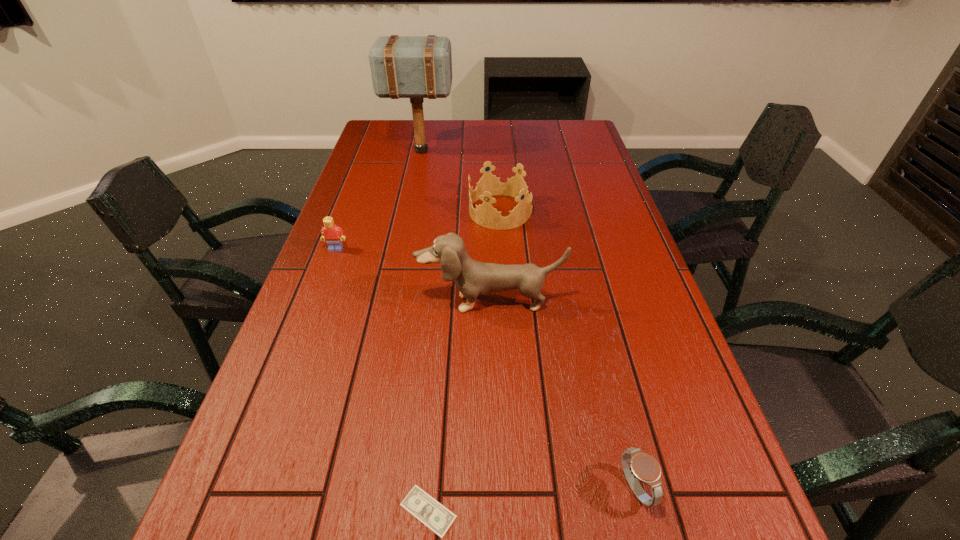
The width and height of the screenshot is (960, 540). Find the location of `Lego that is positioned at the left edge`. Lego that is positioned at the left edge is located at coordinates (333, 235).

At what (x,y) coordinates should I click in order to perform the action: click on object that is at the right edge. Please return your answer as a coordinate pair (x, y). Looking at the image, I should click on (637, 465).

In order to click on object that is at the far left corner in this screenshot , I will do `click(416, 67)`.

You are a GUI agent. You are given a task and a screenshot of the screen. Output one action in this format:
    pyautogui.click(x=<x>, y=<y>)
    Task: Click on the free space at the far edge
    The width and height of the screenshot is (960, 540).
    Given the screenshot: What is the action you would take?
    pyautogui.click(x=538, y=132)

In the image, there is a desktop. What are the coordinates of `vacant region at the left edge` in the screenshot? It's located at (258, 470).

The width and height of the screenshot is (960, 540). I want to click on free region at the right edge, so click(645, 275).

Find the location of a particular element. vacant space at the far left corner of the desktop is located at coordinates (411, 124).

Where is `vacant space at the far right corner of the desktop`? This screenshot has width=960, height=540. vacant space at the far right corner of the desktop is located at coordinates click(x=575, y=124).

The width and height of the screenshot is (960, 540). Find the location of `vacant area that lies between the third nearest object and the rightmost object`. vacant area that lies between the third nearest object and the rightmost object is located at coordinates (562, 395).

This screenshot has height=540, width=960. Identify the location of vacant point located between the farthest object and the third nearest object. (455, 227).